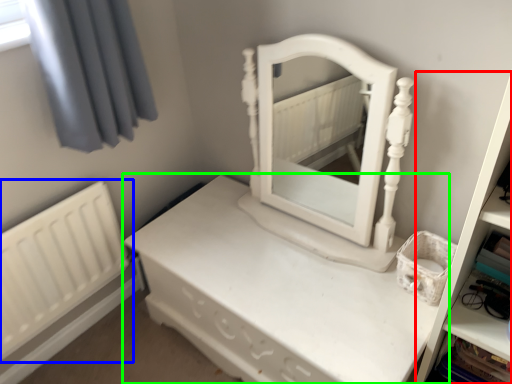
Question: Which object is positioned farthest from bookshelf (highlighted by a red box)? Select from radiator (highlighted by a blue box) and nightstand (highlighted by a green box).

Choices:
 (A) radiator
 (B) nightstand

Answer: (A)